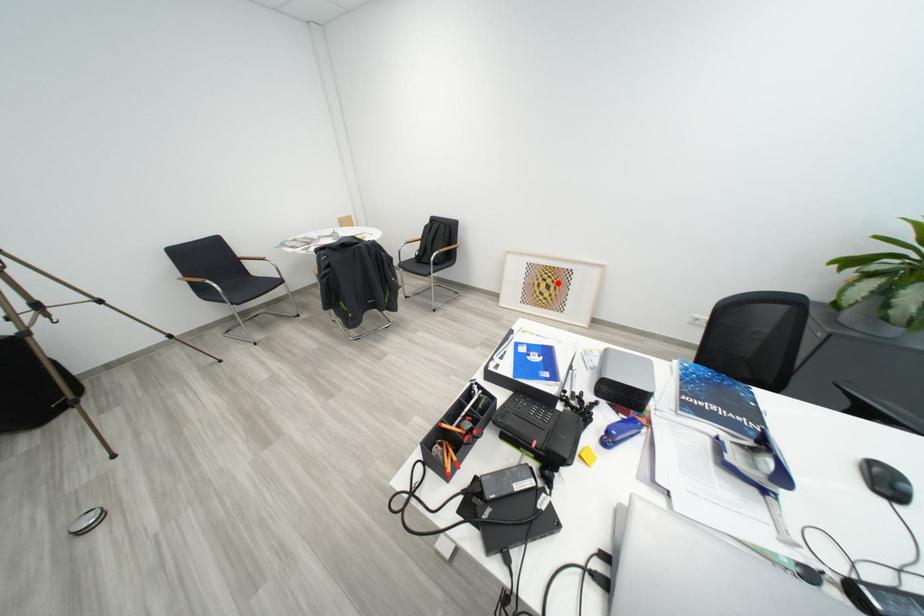
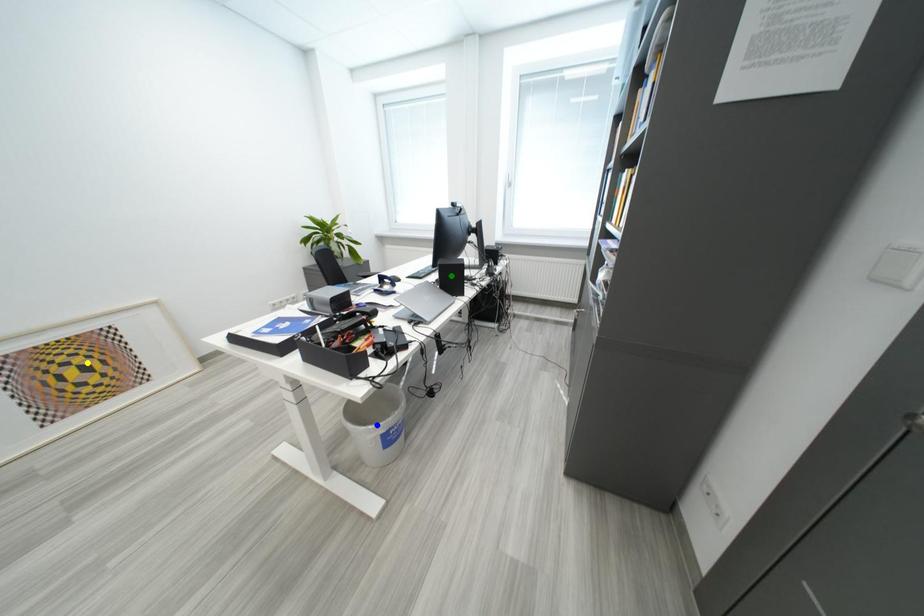
Question: I am providing you with two images of the same scene from different viewpoints. A red point is marked on the first image. You are given multiple points on the second image. In image 2, which mark is for the same physical point as the one in image 1?

Choices:
 (A) blue point
 (B) green point
 (C) yellow point

Answer: (C)